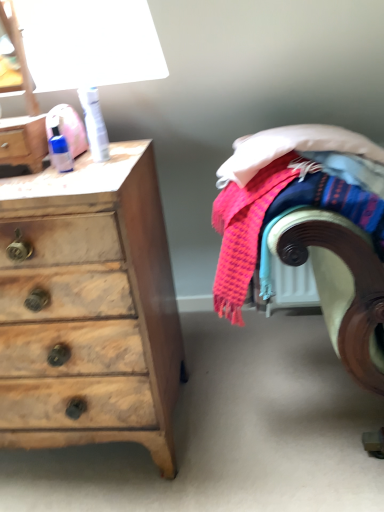
Where is `vacant area that lies to the right of matte plastic bottle at upper left`? The image size is (384, 512). vacant area that lies to the right of matte plastic bottle at upper left is located at coordinates (95, 163).